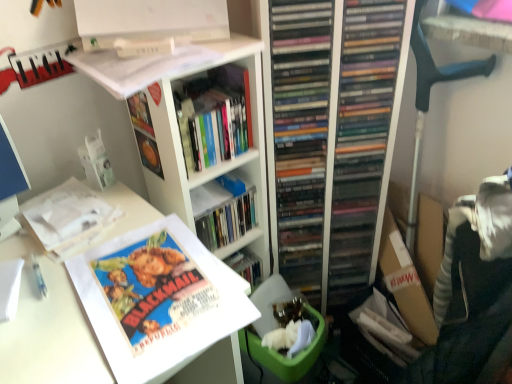
What do you see at coordinates (218, 162) in the screenshot?
I see `white matte bookshelf at upper center` at bounding box center [218, 162].

The width and height of the screenshot is (512, 384). What do you see at coordinates (214, 116) in the screenshot?
I see `hardcover book at center, the first book from the top` at bounding box center [214, 116].

Locate an element on the screen. The image size is (512, 384). white paper at upper left, which appears as the 2th book when ordered from the bottom is located at coordinates (69, 218).

Find the location of a particular element. The width and height of the screenshot is (512, 384). bookshelf lying below the black plastic computer chair at right (from the image's perspective) is located at coordinates (218, 162).

From a real-world perspective, between white matte bookshelf at upper center and black plastic computer chair at right, who is vertically lower?

white matte bookshelf at upper center is physically lower.

How many degrees apart are the facing directions of white matte bookshelf at upper center and black plastic computer chair at right?

The angle between the facing direction of white matte bookshelf at upper center and the facing direction of black plastic computer chair at right is 90.6 degrees.

Looking at this image, is white matte bookshelf at upper center with black plastic computer chair at right?

There is a gap between white matte bookshelf at upper center and black plastic computer chair at right.

How much distance is there between hardcover book at center, the first book from the top, and white paper at upper left, acting as the 2th book starting from the top?

They are 10.76 inches apart.

From the image's perspective, is hardcover book at center, the first book from the top, above white paper at upper left, which appears as the 2th book when ordered from the bottom?

Yes, from the image's perspective, hardcover book at center, the first book from the top, is on top of white paper at upper left, which appears as the 2th book when ordered from the bottom.

Which of these two, hardcover book at center, placed as the third book when sorted from bottom to top, or white paper at upper left, which appears as the 2th book when ordered from the bottom, is thinner?

white paper at upper left, which appears as the 2th book when ordered from the bottom.

Is hardcover book at center, placed as the third book when sorted from bottom to top, at the right side of white paper at upper left, which appears as the 2th book when ordered from the bottom?

Correct, you'll find hardcover book at center, placed as the third book when sorted from bottom to top, to the right of white paper at upper left, which appears as the 2th book when ordered from the bottom.

Measure the distance between white paper at upper left, which appears as the 2th book when ordered from the bottom, and matte paper poster at lower left, which appears as the third book when viewed from the top.

A distance of 6.28 inches exists between white paper at upper left, which appears as the 2th book when ordered from the bottom, and matte paper poster at lower left, which appears as the third book when viewed from the top.

Locate an element on the screen. book that appears in front of the white paper at upper left, which appears as the 2th book when ordered from the bottom is located at coordinates (157, 298).

Which object is positioned more to the left, white paper at upper left, which appears as the 2th book when ordered from the bottom, or matte paper poster at lower left, placed as the 1th book when sorted from bottom to top?

white paper at upper left, which appears as the 2th book when ordered from the bottom.

From the picture: Which object is closer to the camera, white paper at upper left, which appears as the 2th book when ordered from the bottom, or matte paper poster at lower left, placed as the 1th book when sorted from bottom to top?

matte paper poster at lower left, placed as the 1th book when sorted from bottom to top, is more forward.

Can you confirm if white paper at upper left, which appears as the 2th book when ordered from the bottom, is bigger than white matte bookshelf at upper center?

Actually, white paper at upper left, which appears as the 2th book when ordered from the bottom, might be smaller than white matte bookshelf at upper center.

Consider the image. Is white paper at upper left, which appears as the 2th book when ordered from the bottom, facing towards white matte bookshelf at upper center?

No, white paper at upper left, which appears as the 2th book when ordered from the bottom, is not aimed at white matte bookshelf at upper center.

Is white paper at upper left, acting as the 2th book starting from the top, far from white matte bookshelf at upper center?

They are positioned close to each other.

Is white matte bookshelf at upper center in contact with hardcover book at center, the first book from the top?

Yes, white matte bookshelf at upper center is touching hardcover book at center, the first book from the top.

From the picture: Considering the relative sizes of white matte bookshelf at upper center and hardcover book at center, placed as the third book when sorted from bottom to top, in the image provided, is white matte bookshelf at upper center thinner than hardcover book at center, placed as the third book when sorted from bottom to top,?

In fact, white matte bookshelf at upper center might be wider than hardcover book at center, placed as the third book when sorted from bottom to top.

From the image's perspective, would you say white matte bookshelf at upper center is positioned over hardcover book at center, the first book from the top?

Actually, white matte bookshelf at upper center appears below hardcover book at center, the first book from the top, in the image.

Does point (261, 45) come behind point (239, 150)?

No.

Is hardcover book at center, placed as the third book when sorted from bottom to top, at the right side of black plastic computer chair at right?

No, hardcover book at center, placed as the third book when sorted from bottom to top, is not to the right of black plastic computer chair at right.

Could you tell me if hardcover book at center, placed as the third book when sorted from bottom to top, is facing black plastic computer chair at right?

No, hardcover book at center, placed as the third book when sorted from bottom to top, is not oriented towards black plastic computer chair at right.

Considering the relative sizes of hardcover book at center, placed as the third book when sorted from bottom to top, and black plastic computer chair at right in the image provided, is hardcover book at center, placed as the third book when sorted from bottom to top, taller than black plastic computer chair at right?

No.

Which is more to the left, black plastic computer chair at right or white paper at upper left, which appears as the 2th book when ordered from the bottom?

Positioned to the left is white paper at upper left, which appears as the 2th book when ordered from the bottom.

Does black plastic computer chair at right have a greater height compared to white paper at upper left, acting as the 2th book starting from the top?

Yes, black plastic computer chair at right is taller than white paper at upper left, acting as the 2th book starting from the top.

Can you tell me how much black plastic computer chair at right and white paper at upper left, which appears as the 2th book when ordered from the bottom, differ in facing direction?

→ There is a 97.3-degree angle between the facing directions of black plastic computer chair at right and white paper at upper left, which appears as the 2th book when ordered from the bottom.

Is black plastic computer chair at right behind white paper at upper left, acting as the 2th book starting from the top?

Yes, black plastic computer chair at right is behind white paper at upper left, acting as the 2th book starting from the top.

In order to click on computer chair above the white matte bookshelf at upper center (from the image's perspective) in this screenshot , I will do `click(429, 100)`.

Which book is the 1st one when counting from the front of the hardcover book at center, placed as the third book when sorted from bottom to top? Please provide its 2D coordinates.

[(69, 218)]

Which object lies further to the anchor point black plastic computer chair at right, hardcover book at center, the first book from the top, or matte paper poster at lower left, which appears as the third book when viewed from the top?

Among the two, matte paper poster at lower left, which appears as the third book when viewed from the top, is located further to black plastic computer chair at right.

In the scene shown: Based on their spatial positions, is hardcover book at center, the first book from the top, or white paper at upper left, which appears as the 2th book when ordered from the bottom, further from black plastic computer chair at right?

white paper at upper left, which appears as the 2th book when ordered from the bottom, is positioned further to the anchor black plastic computer chair at right.

When comparing their distances from white paper at upper left, acting as the 2th book starting from the top, does matte paper poster at lower left, placed as the 1th book when sorted from bottom to top, or black plastic computer chair at right seem further?

Among the two, black plastic computer chair at right is located further to white paper at upper left, acting as the 2th book starting from the top.

Which object lies nearer to the anchor point matte paper poster at lower left, placed as the 1th book when sorted from bottom to top, white paper at upper left, acting as the 2th book starting from the top, or white matte bookshelf at upper center?

white paper at upper left, acting as the 2th book starting from the top, is closer to matte paper poster at lower left, placed as the 1th book when sorted from bottom to top.

When comparing their distances from hardcover book at center, placed as the third book when sorted from bottom to top, does white paper at upper left, which appears as the 2th book when ordered from the bottom, or black plastic computer chair at right seem further?

The object further to hardcover book at center, placed as the third book when sorted from bottom to top, is black plastic computer chair at right.

Estimate the real-world distances between objects in this image. Which object is closer to black plastic computer chair at right, white matte bookshelf at upper center or hardcover book at center, placed as the third book when sorted from bottom to top?

hardcover book at center, placed as the third book when sorted from bottom to top, lies closer to black plastic computer chair at right than the other object.

Which object lies further to the anchor point matte paper poster at lower left, which appears as the third book when viewed from the top, white matte bookshelf at upper center or white paper at upper left, acting as the 2th book starting from the top?

white matte bookshelf at upper center is positioned further to the anchor matte paper poster at lower left, which appears as the third book when viewed from the top.

Considering their positions, is matte paper poster at lower left, placed as the 1th book when sorted from bottom to top, positioned closer to black plastic computer chair at right than hardcover book at center, the first book from the top?

hardcover book at center, the first book from the top, lies closer to black plastic computer chair at right than the other object.

Where is `book between white paper at upper left, acting as the 2th book starting from the top, and white matte bookshelf at upper center from left to right`? book between white paper at upper left, acting as the 2th book starting from the top, and white matte bookshelf at upper center from left to right is located at coordinates (157, 298).

Identify the location of book between hardcover book at center, the first book from the top, and matte paper poster at lower left, placed as the 1th book when sorted from bottom to top, from top to bottom. Image resolution: width=512 pixels, height=384 pixels. (69, 218).

You are a GUI agent. You are given a task and a screenshot of the screen. Output one action in this format:
    pyautogui.click(x=<x>, y=<y>)
    Task: Click on the bookshelf between matte paper poster at lower left, placed as the 1th book when sorted from bottom to top, and black plastic computer chair at right, in the horizontal direction
    This screenshot has height=384, width=512.
    Given the screenshot: What is the action you would take?
    pyautogui.click(x=218, y=162)

Identify the location of bookshelf between white paper at upper left, which appears as the 2th book when ordered from the bottom, and hardcover book at center, the first book from the top, in the horizontal direction. This screenshot has width=512, height=384. (218, 162).